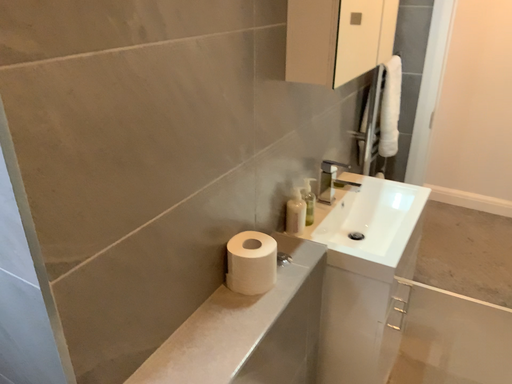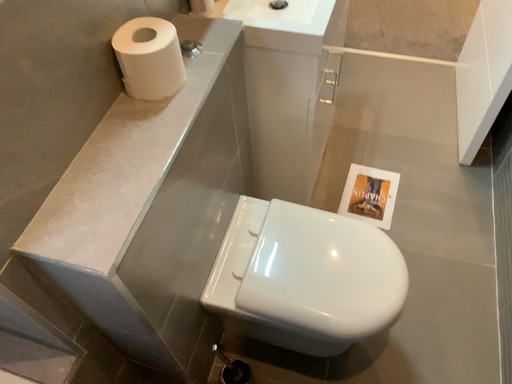
Question: Which way did the camera rotate in the video?

Choices:
 (A) rotated right
 (B) rotated left

Answer: (A)